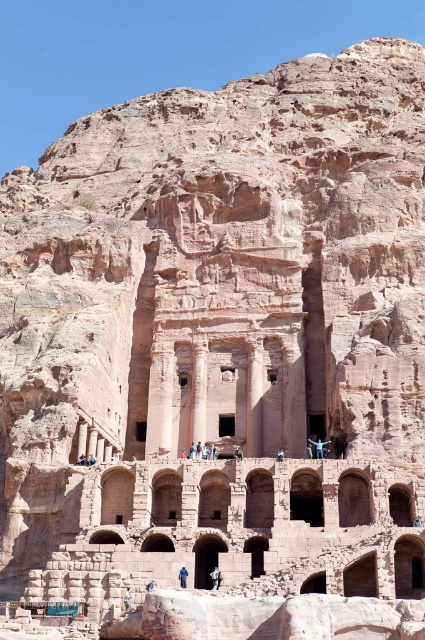
Question: Can you confirm if dark brown leather jacket at center is positioned to the right of blue fabric person at center?

Choices:
 (A) no
 (B) yes

Answer: (B)

Question: Among these objects, which one is farthest from the camera?

Choices:
 (A) dark brown leather jacket at center
 (B) blue fabric person at center

Answer: (B)

Question: Which point is farther to the camera?

Choices:
 (A) dark brown leather jacket at center
 (B) blue fabric person at center

Answer: (B)

Question: Can you confirm if dark brown leather jacket at center is wider than blue fabric person at center?

Choices:
 (A) no
 (B) yes

Answer: (B)

Question: Does dark brown leather jacket at center appear over blue fabric person at center?

Choices:
 (A) yes
 (B) no

Answer: (B)